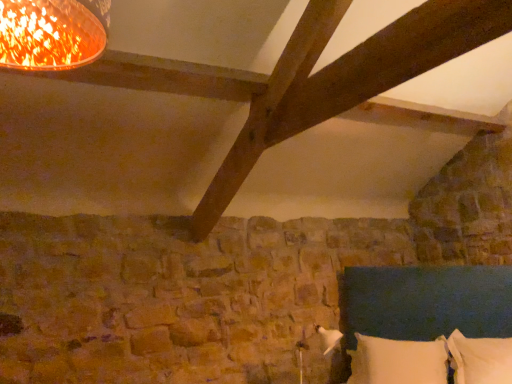
Question: Would you say white soft pillow at lower right, which ranks as the 1th pillow in left-to-right order, is part of dark blue fabric bed at lower right's contents?

Choices:
 (A) yes
 (B) no

Answer: (A)

Question: Is dark blue fabric bed at lower right at the right side of white soft pillow at lower right, which ranks as the 2th pillow in right-to-left order?

Choices:
 (A) yes
 (B) no

Answer: (B)

Question: From a real-world perspective, is dark blue fabric bed at lower right positioned under white soft pillow at lower right, which ranks as the 1th pillow in left-to-right order, based on gravity?

Choices:
 (A) yes
 (B) no

Answer: (B)

Question: Can you confirm if dark blue fabric bed at lower right is smaller than white soft pillow at lower right, which ranks as the 1th pillow in left-to-right order?

Choices:
 (A) yes
 (B) no

Answer: (B)

Question: Is dark blue fabric bed at lower right to the left of white soft pillow at lower right, which ranks as the 2th pillow in right-to-left order, from the viewer's perspective?

Choices:
 (A) yes
 (B) no

Answer: (A)

Question: Is white soft pillow at lower right, which appears as the second pillow when viewed from the left, situated inside white soft pillow at lower right, which ranks as the 2th pillow in right-to-left order, or outside?

Choices:
 (A) inside
 (B) outside

Answer: (B)

Question: Looking at the image, does white soft pillow at lower right, which appears as the second pillow when viewed from the left, seem bigger or smaller compared to white soft pillow at lower right, which ranks as the 1th pillow in left-to-right order?

Choices:
 (A) small
 (B) big

Answer: (A)

Question: Considering their positions, is white soft pillow at lower right, the 1th pillow viewed from the right, located in front of or behind white soft pillow at lower right, which ranks as the 1th pillow in left-to-right order?

Choices:
 (A) behind
 (B) front

Answer: (B)

Question: In terms of width, does white soft pillow at lower right, which appears as the second pillow when viewed from the left, look wider or thinner when compared to white soft pillow at lower right, which ranks as the 1th pillow in left-to-right order?

Choices:
 (A) wide
 (B) thin

Answer: (B)

Question: Is white soft pillow at lower right, which appears as the second pillow when viewed from the left, to the left or to the right of dark blue fabric bed at lower right in the image?

Choices:
 (A) right
 (B) left

Answer: (A)

Question: Is white soft pillow at lower right, which appears as the second pillow when viewed from the left, inside the boundaries of dark blue fabric bed at lower right, or outside?

Choices:
 (A) inside
 (B) outside

Answer: (A)

Question: In terms of width, does white soft pillow at lower right, which appears as the second pillow when viewed from the left, look wider or thinner when compared to dark blue fabric bed at lower right?

Choices:
 (A) thin
 (B) wide

Answer: (A)

Question: Considering their positions, is white soft pillow at lower right, the 1th pillow viewed from the right, located in front of or behind dark blue fabric bed at lower right?

Choices:
 (A) behind
 (B) front

Answer: (A)

Question: Considering the positions of dark blue fabric bed at lower right and white soft pillow at lower right, the 1th pillow viewed from the right, in the image, is dark blue fabric bed at lower right taller or shorter than white soft pillow at lower right, the 1th pillow viewed from the right,?

Choices:
 (A) short
 (B) tall

Answer: (B)

Question: Does point (505, 302) appear closer or farther from the camera than point (499, 370)?

Choices:
 (A) farther
 (B) closer

Answer: (A)